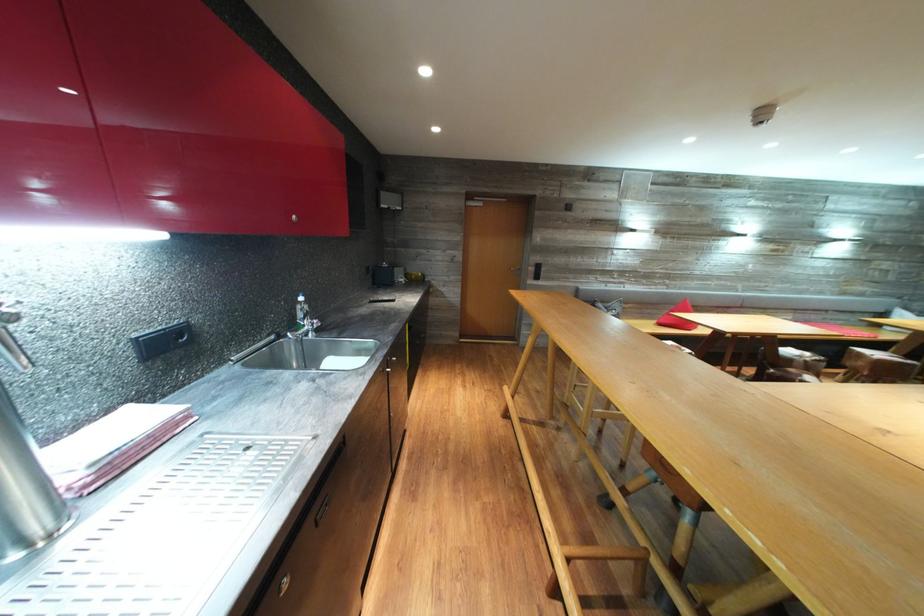
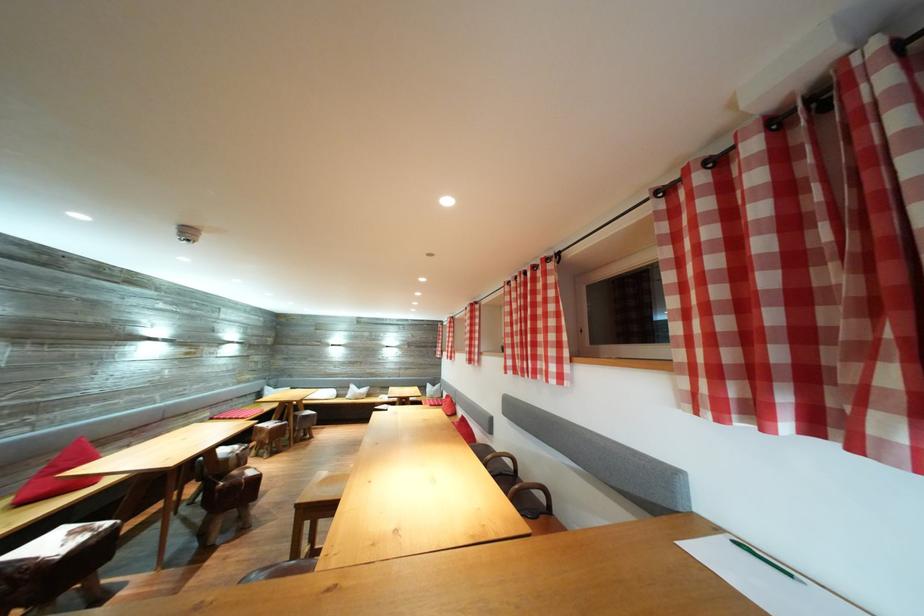
The point at (796,376) is marked in the first image. Where is the corresponding point in the second image?

(241, 477)